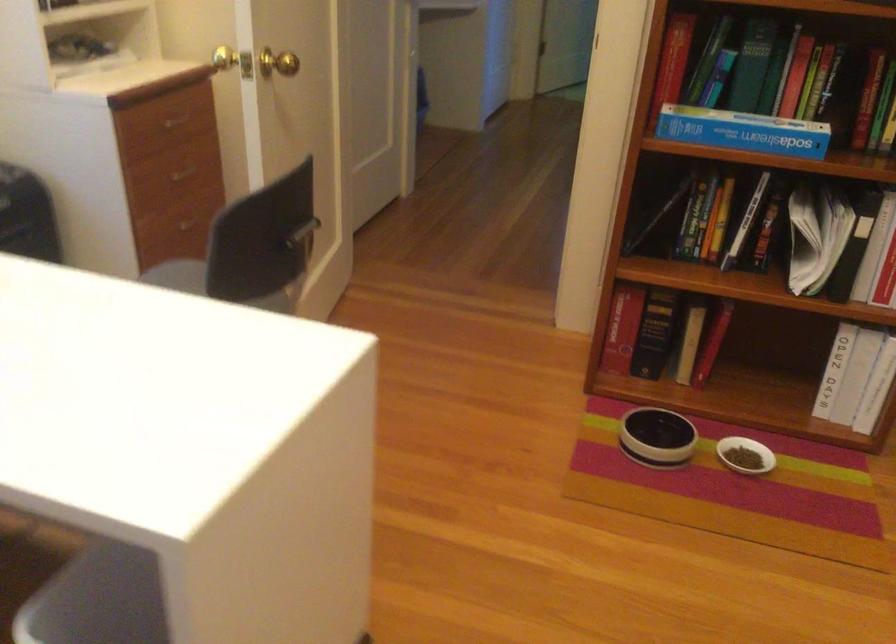
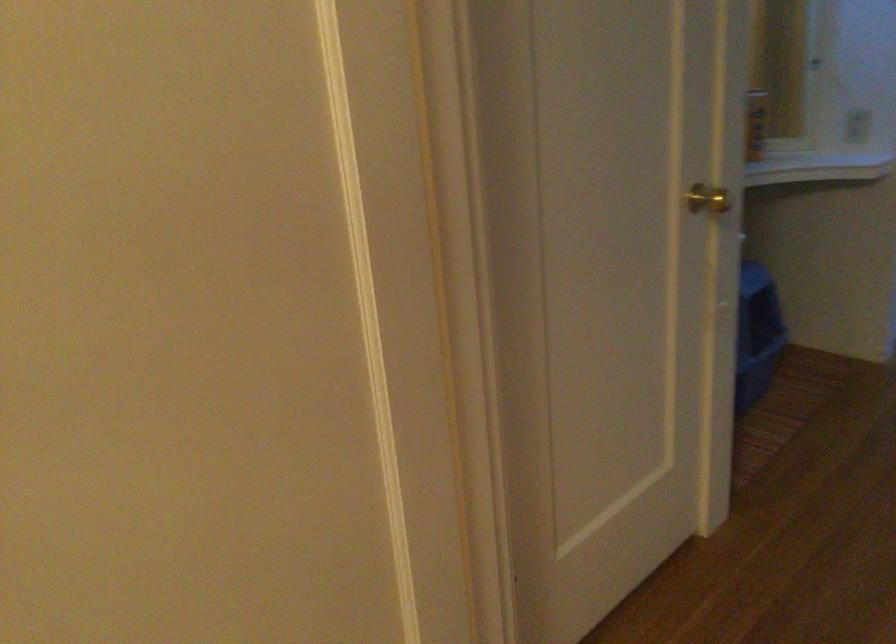
Question: In a continuous first-person perspective shot, in which direction is the camera moving?

Choices:
 (A) Left
 (B) Right
 (C) Forward
 (D) Backward

Answer: (C)